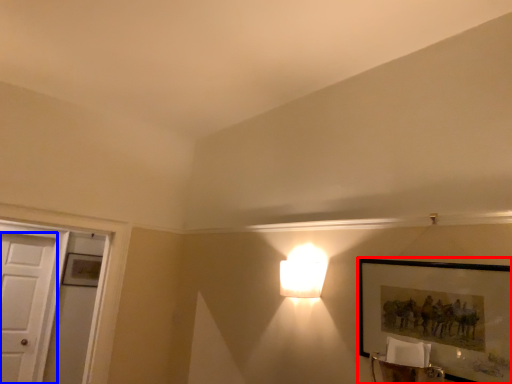
Question: Which object appears closest to the camera in this image, picture frame (highlighted by a red box) or door (highlighted by a blue box)?

Choices:
 (A) picture frame
 (B) door

Answer: (A)